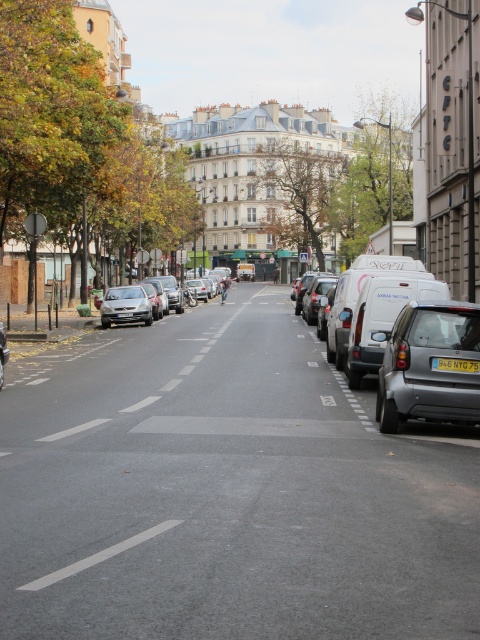
How much distance is there between silver metallic car at center and silver metallic hatchback at left?

silver metallic car at center is 7.25 feet away from silver metallic hatchback at left.

From the picture: Does silver metallic car at center have a greater height compared to silver metallic hatchback at left?

Correct, silver metallic car at center is much taller as silver metallic hatchback at left.

Does point (106, 310) come in front of point (107, 316)?

No, (106, 310) is further to viewer.

Where is `silver metallic car at center`? silver metallic car at center is located at coordinates (139, 301).

Can you confirm if silver metallic car at center is smaller than white glossy line at center?

No.

Who is taller, silver metallic car at center or white glossy line at center?

With more height is silver metallic car at center.

Is point (147, 305) closer to camera compared to point (117, 548)?

No, (147, 305) is behind (117, 548).

Image resolution: width=480 pixels, height=640 pixels. I want to click on silver metallic car at center, so click(139, 301).

Does white glossy line at center have a larger size compared to yellow plastic license plate at center?

Indeed, white glossy line at center has a larger size compared to yellow plastic license plate at center.

Is point (72, 566) farther from viewer compared to point (468, 365)?

No, it is in front of (468, 365).

Between point (33, 589) and point (435, 362), which one is positioned behind?

The point (435, 362) is behind.

The image size is (480, 640). Identify the location of white glossy line at center. (98, 556).